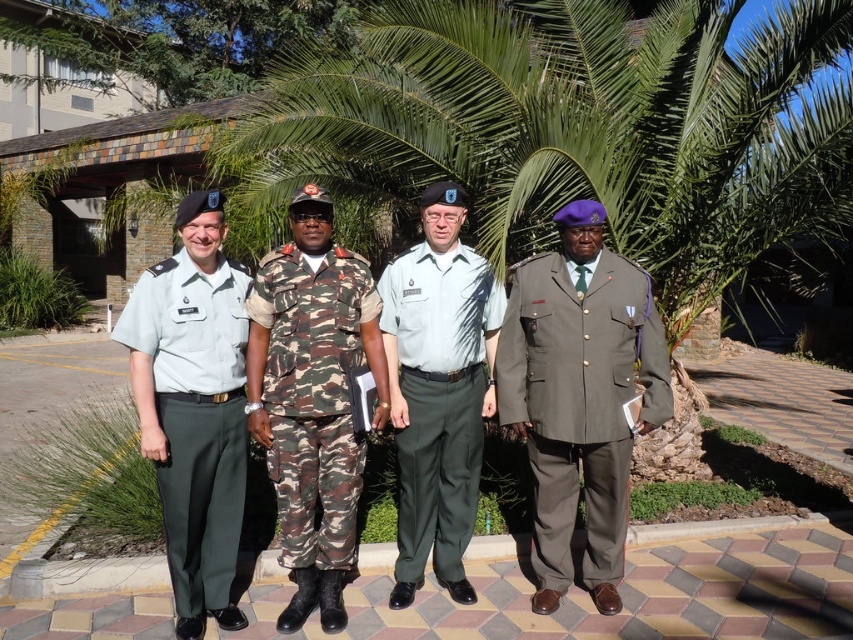
You are a photographer standing in front of the building. You want to take a photo that includes both the point at (589,236) and the point at (434,454). Which point should you focus on to ensure both are in sharp focus?

You should focus on the point closer to the camera, which is point (589,236), to ensure both points are in sharp focus since it is closer and the depth of field will extend backward to the farther point.

You are a photographer trying to capture a portrait of both the camouflage fabric uniform at center and the light gray cotton shirt at center. Which one should you focus on first if you want to ensure both are in focus?

The camouflage fabric uniform at center is above the light gray cotton shirt at center, so focusing on the camouflage fabric uniform at center first would ensure both are in focus.